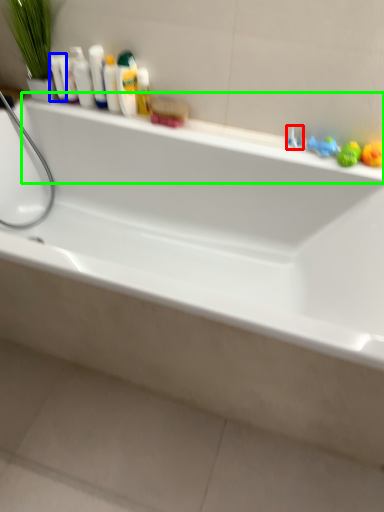
Question: Which object is the closest to the faucet (highlighted by a red box)? Choose among these: mouthwash (highlighted by a blue box) or ledge (highlighted by a green box).

Choices:
 (A) mouthwash
 (B) ledge

Answer: (B)